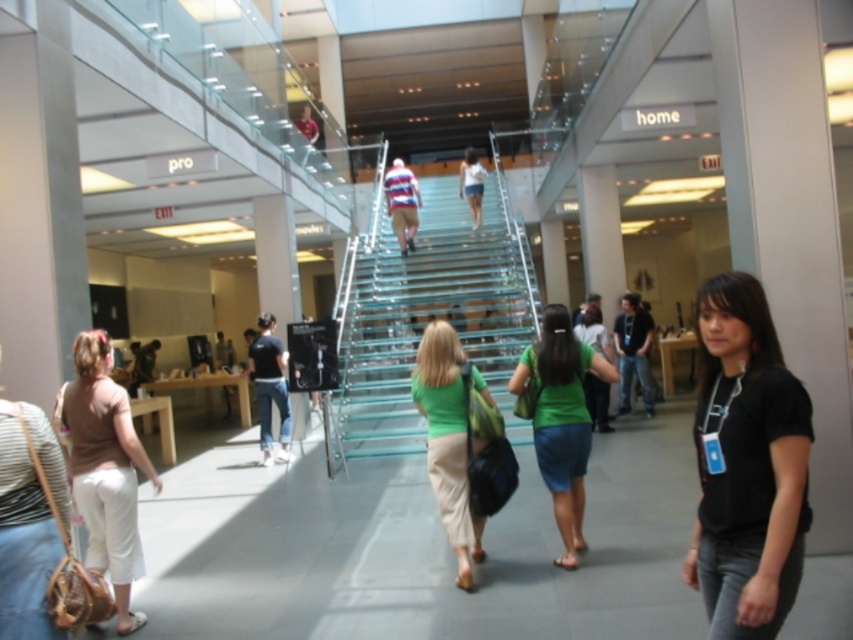
Which is in front, point (393, 364) or point (410, 225)?

Point (393, 364) is in front.

You are a GUI agent. You are given a task and a screenshot of the screen. Output one action in this format:
    pyautogui.click(x=<x>, y=<y>)
    Task: Click on the transparent glass stairs at center
    The image size is (853, 640).
    Given the screenshot: What is the action you would take?
    pyautogui.click(x=425, y=314)

Between black cotton shirt at lower right and white matte shirt at center, which one appears on the left side from the viewer's perspective?

From the viewer's perspective, white matte shirt at center appears more on the left side.

Can you confirm if black cotton shirt at lower right is wider than white matte shirt at center?

Yes, black cotton shirt at lower right is wider than white matte shirt at center.

Between point (740, 547) and point (473, 157), which one is positioned behind?

The point (473, 157) is behind.

At what (x,y) coordinates should I click in order to perform the action: click on black cotton shirt at lower right. Please return your answer as a coordinate pair (x, y). This screenshot has height=640, width=853. Looking at the image, I should click on (746, 465).

Is black cotton shirt at lower right wider than matte brown purse at lower left?

No.

Which is more to the left, black cotton shirt at lower right or matte brown purse at lower left?

From the viewer's perspective, matte brown purse at lower left appears more on the left side.

Which is behind, point (785, 400) or point (102, 531)?

Point (102, 531)

The width and height of the screenshot is (853, 640). What are the coordinates of `black cotton shirt at lower right` in the screenshot? It's located at (746, 465).